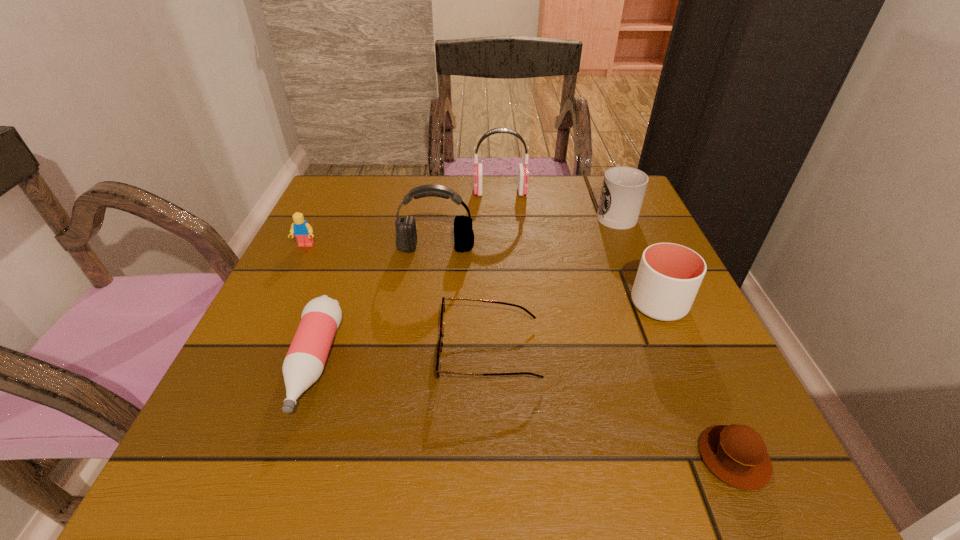
The height and width of the screenshot is (540, 960). I want to click on free point that satisfies the following two spatial constraints: 1. with the cap open on the bottle; 2. on the right side of the nearest object, so click(x=281, y=457).